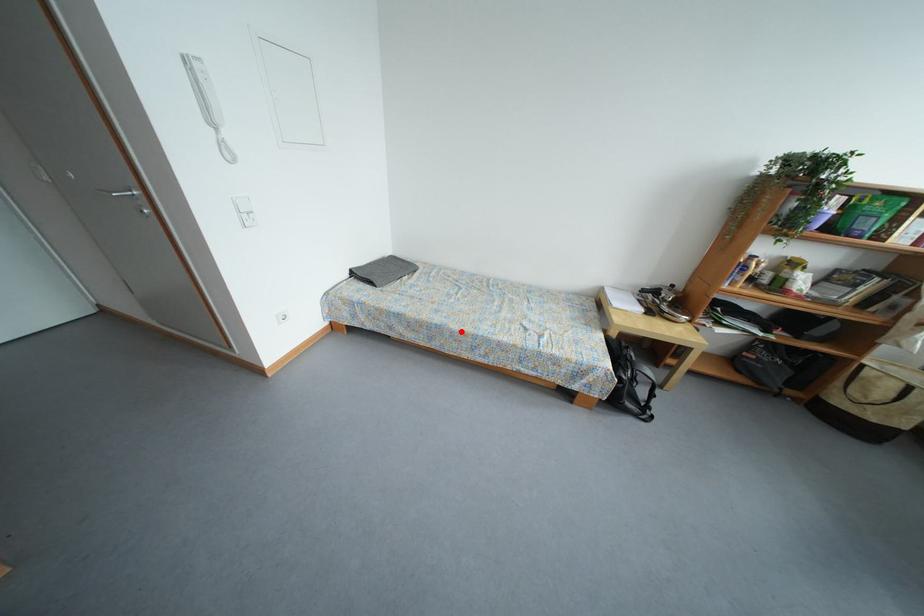
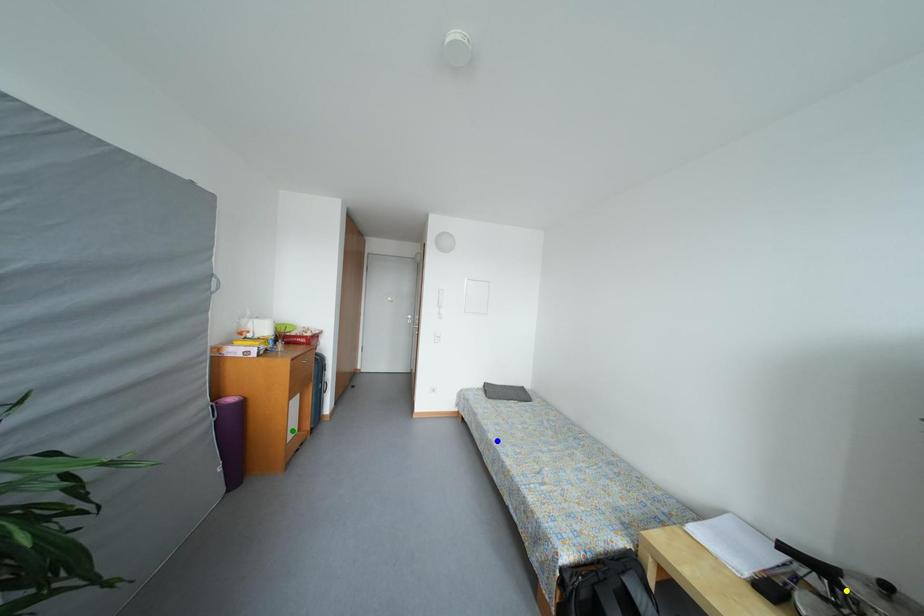
Question: I am providing you with two images of the same scene from different viewpoints. A red point is marked on the first image. You are given multiple points on the second image. Which point in image 2 is actually the same real-world point as the red point in image 1?

Choices:
 (A) green point
 (B) yellow point
 (C) blue point

Answer: (C)